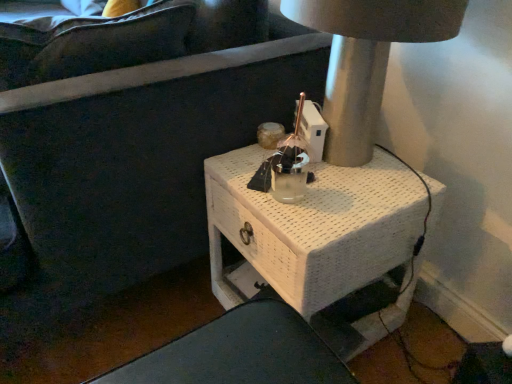
Question: Is matte gray table lamp at upper right wider or thinner than white woven table at center?

Choices:
 (A) wide
 (B) thin

Answer: (B)

Question: From a real-world perspective, is matte gray table lamp at upper right physically located above or below white woven table at center?

Choices:
 (A) above
 (B) below

Answer: (A)

Question: Considering their positions, is matte gray table lamp at upper right located in front of or behind white woven table at center?

Choices:
 (A) behind
 (B) front

Answer: (B)

Question: From the image's perspective, is white woven table at center located above or below matte gray table lamp at upper right?

Choices:
 (A) below
 (B) above

Answer: (A)

Question: Looking at the image, does white woven table at center seem bigger or smaller compared to matte gray table lamp at upper right?

Choices:
 (A) small
 (B) big

Answer: (B)

Question: Relative to matte gray table lamp at upper right, is white woven table at center in front or behind?

Choices:
 (A) behind
 (B) front

Answer: (A)

Question: From a real-world perspective, is white woven table at center physically located above or below matte gray table lamp at upper right?

Choices:
 (A) below
 (B) above

Answer: (A)